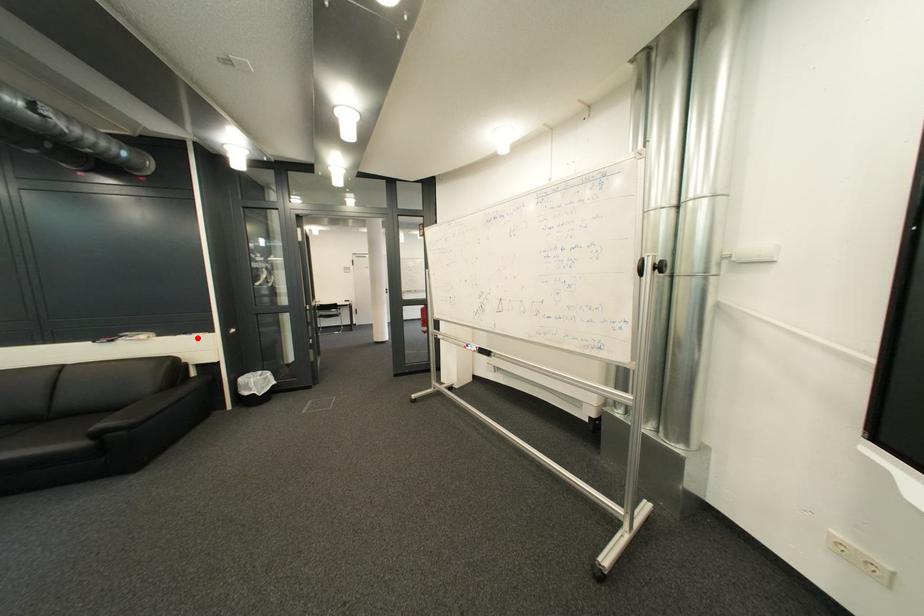
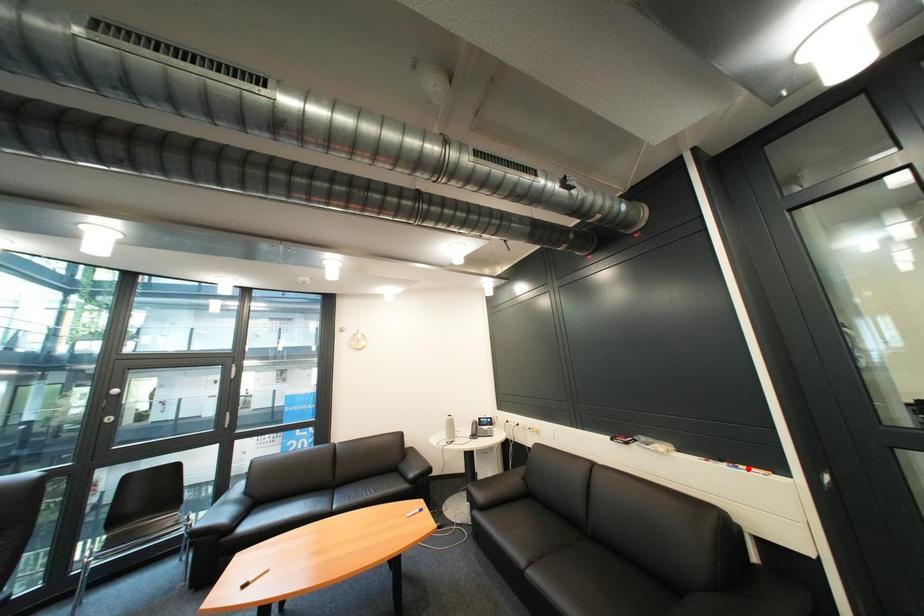
I am providing you with two images of the same scene from different viewpoints. A red point is marked on the first image and another point is marked on the second image. Are the points marked in image1 and image2 representing the same 3D position?

No